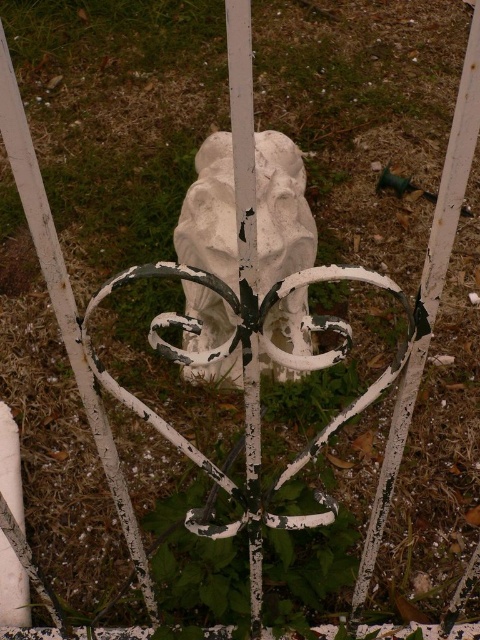
Question: Can you confirm if white matte stone lion at center is smaller than white painted metal pole at center?

Choices:
 (A) no
 (B) yes

Answer: (A)

Question: Does white matte stone lion at center appear over white painted metal pole at center?

Choices:
 (A) no
 (B) yes

Answer: (B)

Question: In this image, where is white matte stone lion at center located relative to white painted metal pole at center?

Choices:
 (A) above
 (B) below

Answer: (A)

Question: Which object is farther from the camera taking this photo?

Choices:
 (A) white matte stone lion at center
 (B) white painted metal pole at center

Answer: (A)

Question: Which point appears closest to the camera in this image?

Choices:
 (A) (228, 32)
 (B) (300, 268)

Answer: (A)